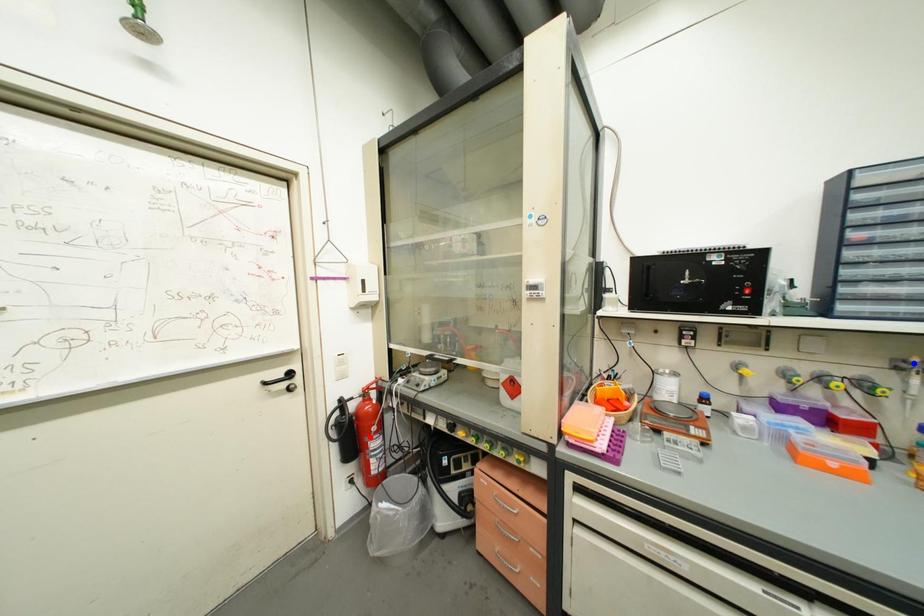
Question: Two points are marked on the image. Which point is closer to the camera?

Choices:
 (A) Blue point is closer.
 (B) Red point is closer.

Answer: (A)